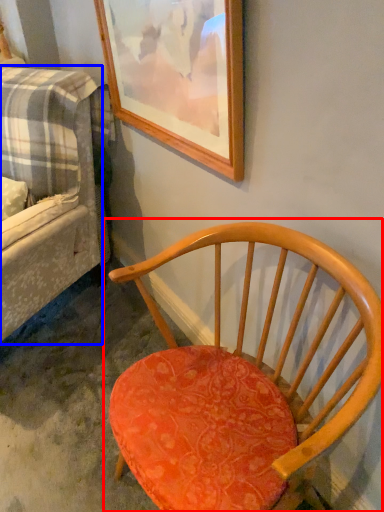
Question: Which point is closer to the camera, chair (highlighted by a red box) or studio couch (highlighted by a blue box)?

Choices:
 (A) chair
 (B) studio couch

Answer: (A)